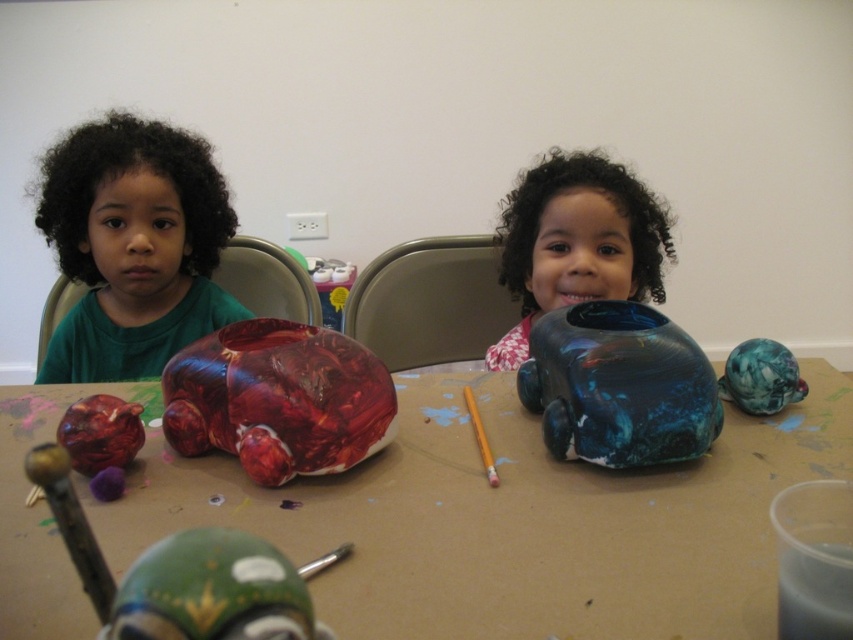
You are a photographer trying to capture a closeup of the shiny plastic car at center. You have a camera that can focus on objects within 40 centimeters. Is the car within the camera focus range?

The shiny plastic car at center is 44.41 centimeters from the camera, which is beyond the camera focus range of 40 centimeters. Therefore, the car is out of focus range.

You are a teacher observing the children at the table. You need to place a small sticker on the smaller object between the shiny plastic car at center and the blue glossy vase at center. Which object should you choose?

The blue glossy vase at center is smaller than the shiny plastic car at center, so you should place the sticker on the blue glossy vase at center.